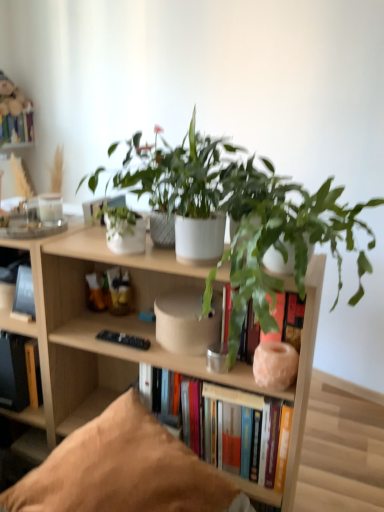
Question: From the image's perspective, is green matte plant at center, which ranks as the second houseplant in left-to-right order, on hardcover books at center, which is the fourth book in top-to-bottom order?

Choices:
 (A) yes
 (B) no

Answer: (A)

Question: Could you tell me if green matte plant at center, positioned as the 1th houseplant in right-to-left order, is facing hardcover books at center, arranged as the 1th book when ordered from the bottom?

Choices:
 (A) no
 (B) yes

Answer: (A)

Question: Considering the relative positions of green matte plant at center, positioned as the 1th houseplant in right-to-left order, and hardcover books at center, which is the fourth book in top-to-bottom order, in the image provided, is green matte plant at center, positioned as the 1th houseplant in right-to-left order, in front of hardcover books at center, which is the fourth book in top-to-bottom order,?

Choices:
 (A) no
 (B) yes

Answer: (B)

Question: Is green matte plant at center, which ranks as the second houseplant in left-to-right order, bigger than hardcover books at center, the 1th book in the right-to-left sequence?

Choices:
 (A) yes
 (B) no

Answer: (A)

Question: Are green matte plant at center, which ranks as the second houseplant in left-to-right order, and hardcover books at center, arranged as the 1th book when ordered from the bottom, far apart?

Choices:
 (A) no
 (B) yes

Answer: (A)

Question: Is black matte book at left, the 2th book when ordered from right to left, bigger or smaller than brown fabric pillow at lower center?

Choices:
 (A) big
 (B) small

Answer: (B)

Question: Is point (24, 266) closer or farther from the camera than point (220, 490)?

Choices:
 (A) farther
 (B) closer

Answer: (A)

Question: Would you say black matte book at left, the 2th book when ordered from right to left, is inside or outside brown fabric pillow at lower center?

Choices:
 (A) outside
 (B) inside

Answer: (A)

Question: In terms of height, does black matte book at left, the third book in the back-to-front sequence, look taller or shorter compared to brown fabric pillow at lower center?

Choices:
 (A) short
 (B) tall

Answer: (A)

Question: From the image's perspective, is hardcover book at left, arranged as the third book when viewed from the front, positioned above or below hardcover book at upper left, arranged as the first book when viewed from the top?

Choices:
 (A) above
 (B) below

Answer: (B)

Question: Is hardcover book at left, the 2th book ordered from the bottom, spatially inside hardcover book at upper left, arranged as the first book when viewed from the top, or outside of it?

Choices:
 (A) inside
 (B) outside

Answer: (B)

Question: Is point (36, 368) positioned closer to the camera than point (23, 118)?

Choices:
 (A) farther
 (B) closer

Answer: (B)

Question: From a real-world perspective, is hardcover book at left, which ranks as the third book in right-to-left order, positioned above or below hardcover book at upper left, the 1th book viewed from the left?

Choices:
 (A) above
 (B) below

Answer: (B)

Question: Is hardcover book at upper left, positioned as the 1th book in back-to-front order, wider or thinner than brown fabric pillow at lower center?

Choices:
 (A) thin
 (B) wide

Answer: (A)

Question: From a real-world perspective, relative to brown fabric pillow at lower center, is hardcover book at upper left, positioned as the 1th book in back-to-front order, vertically above or below?

Choices:
 (A) above
 (B) below

Answer: (A)